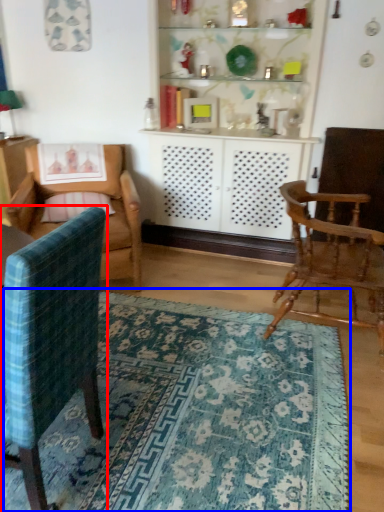
Question: Which point is further to the camera, chair (highlighted by a red box) or mat (highlighted by a blue box)?

Choices:
 (A) chair
 (B) mat

Answer: (B)